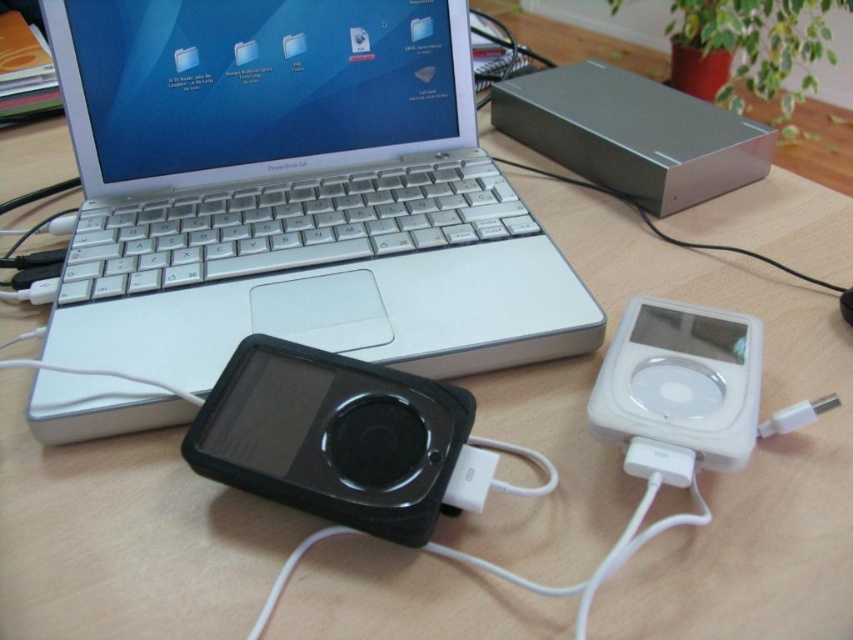
Does black rubberized mp3 player at center have a lesser width compared to white glossy ipod at right?

In fact, black rubberized mp3 player at center might be wider than white glossy ipod at right.

Between point (415, 540) and point (662, 428), which one is positioned behind?

Positioned behind is point (662, 428).

Identify the location of black rubberized mp3 player at center. (332, 436).

What are the coordinates of `black rubberized mp3 player at center` in the screenshot? It's located at (332, 436).

Between white glossy ipod at right and white plastic usb plug at center, which one has more height?

white glossy ipod at right

Who is more distant from viewer, (685, 308) or (454, 486)?

The point (685, 308) is more distant.

The width and height of the screenshot is (853, 640). Find the location of `white glossy ipod at right`. white glossy ipod at right is located at coordinates (679, 390).

How far apart are silver metallic laptop at center and white plastic usb plug at center?

They are 9.27 inches apart.

Is point (218, 122) farther from camera compared to point (474, 468)?

Yes, it is behind point (474, 468).

Is point (322, 241) positioned behind point (489, 480)?

Yes.

I want to click on silver metallic laptop at center, so click(293, 193).